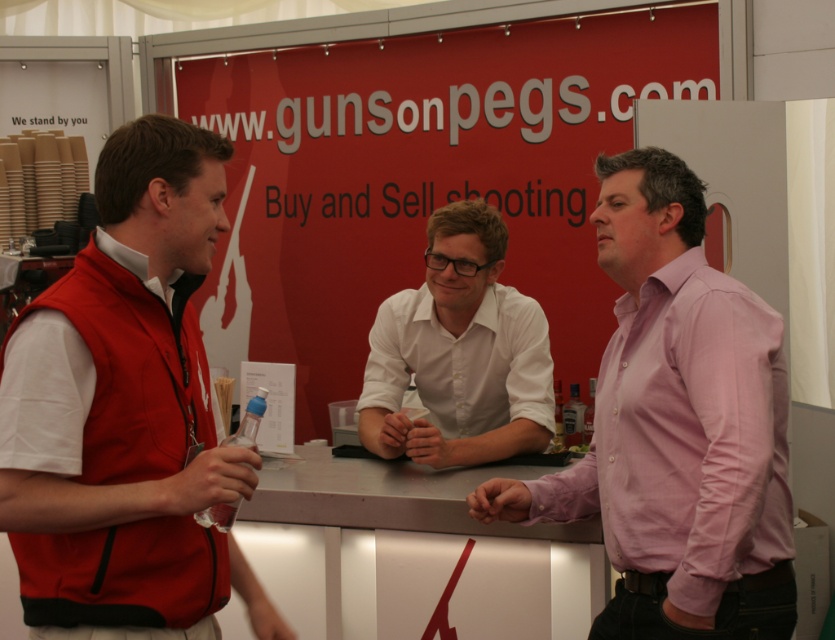
Question: Which of the following is the closest to the observer?

Choices:
 (A) pink cotton shirt at right
 (B) smooth skin hand at center
 (C) pink matte hand at center
 (D) matte red vest at left

Answer: (D)

Question: Among these points, which one is nearest to the camera?

Choices:
 (A) (636, 300)
 (B) (99, 170)
 (C) (436, 435)
 (D) (527, 328)

Answer: (B)

Question: Which object is positioned farthest from the pink matte hand at center?

Choices:
 (A) smooth skin hand at center
 (B) pink cotton shirt at right
 (C) white glossy shirt at center

Answer: (C)

Question: Does pink matte hand at center have a lesser width compared to smooth skin hand at center?

Choices:
 (A) yes
 (B) no

Answer: (A)

Question: From the image, what is the correct spatial relationship of clear plastic bottle at center in relation to smooth skin hand at center?

Choices:
 (A) right
 (B) left

Answer: (B)

Question: Where is matte red vest at left located in relation to smooth skin hand at center in the image?

Choices:
 (A) right
 (B) left

Answer: (B)